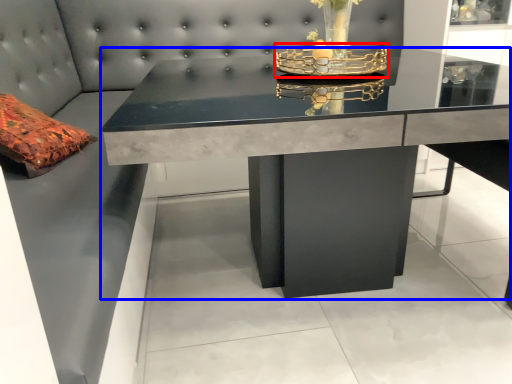
Question: Which point is further to the camera, candle holder (highlighted by a red box) or table (highlighted by a blue box)?

Choices:
 (A) candle holder
 (B) table

Answer: (A)